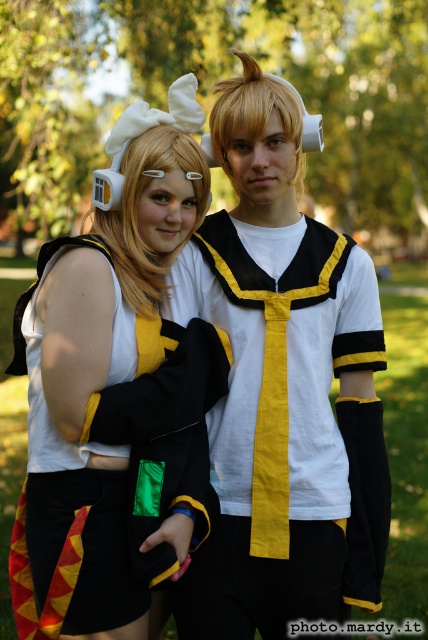
Question: Does matte black sailor uniform at center appear on the right side of matte black coat at center?

Choices:
 (A) yes
 (B) no

Answer: (A)

Question: Does matte black sailor uniform at center lie in front of matte black coat at center?

Choices:
 (A) no
 (B) yes

Answer: (A)

Question: Can you confirm if matte black sailor uniform at center is positioned to the right of matte black coat at center?

Choices:
 (A) yes
 (B) no

Answer: (A)

Question: Which point is farther to the camera?

Choices:
 (A) matte black sailor uniform at center
 (B) matte black coat at center

Answer: (A)

Question: Which object is closer to the camera taking this photo?

Choices:
 (A) matte black sailor uniform at center
 (B) matte black coat at center

Answer: (B)